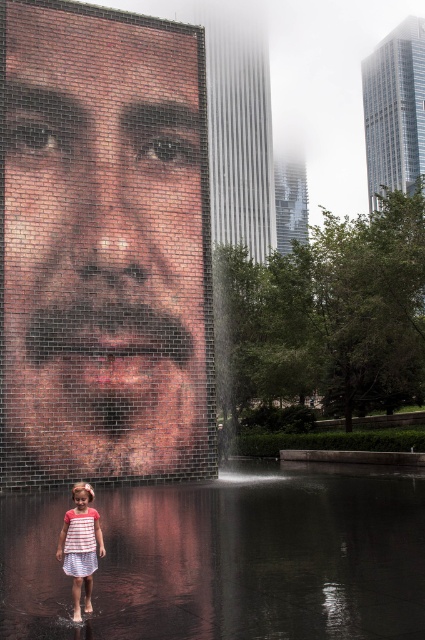
Find the location of a particular element. The width and height of the screenshot is (425, 640). striped cotton dress at lower left is located at coordinates [x=81, y=545].

Consider the image. Is striped cotton dress at lower left taller than white striped dress at lower left?

Indeed, striped cotton dress at lower left has a greater height compared to white striped dress at lower left.

Who is more forward, (x=74, y=540) or (x=87, y=515)?

Positioned in front is point (x=74, y=540).

Image resolution: width=425 pixels, height=640 pixels. What are the coordinates of `striped cotton dress at lower left` in the screenshot? It's located at (81, 545).

Which is in front, point (5, 141) or point (218, 506)?

Point (218, 506)

Is brick mosaic face at center shorter than clear water at center?

No, brick mosaic face at center is not shorter than clear water at center.

Is point (17, 173) farther from viewer compared to point (402, 579)?

Yes, point (17, 173) is behind point (402, 579).

Identify the location of brick mosaic face at center. This screenshot has width=425, height=640. [104, 244].

Measure the distance between clear water at center and camera.

clear water at center is 4.76 meters away from camera.

Between point (300, 496) and point (87, 536), which one is positioned in front?

Point (87, 536)

I want to click on clear water at center, so click(x=229, y=557).